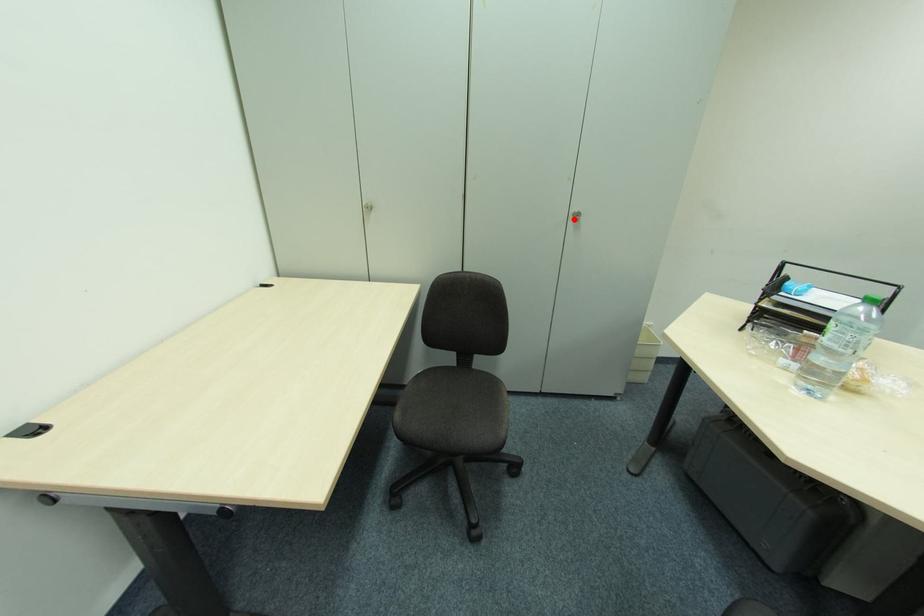
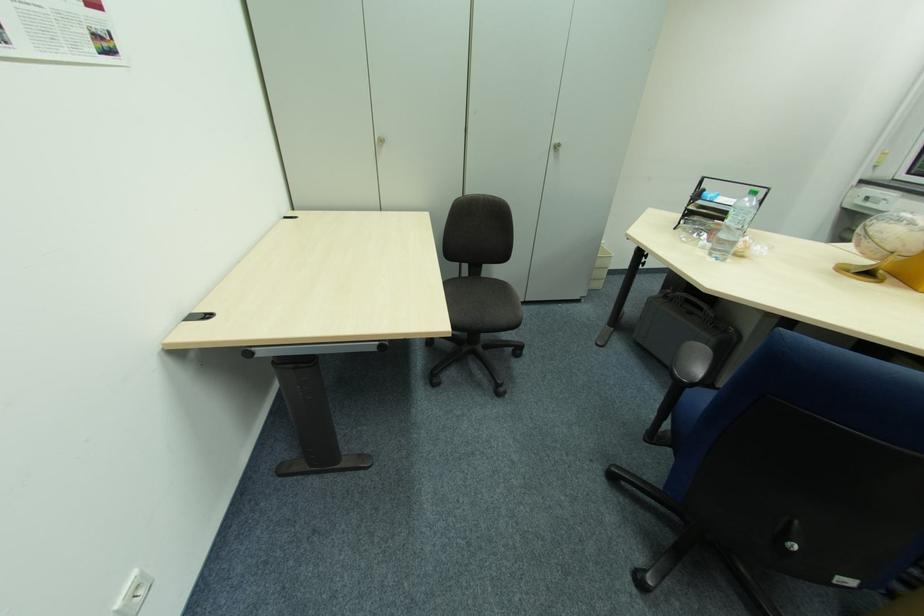
Locate, in the second image, the point that corresponds to the highlighted location in the first image.

(554, 150)